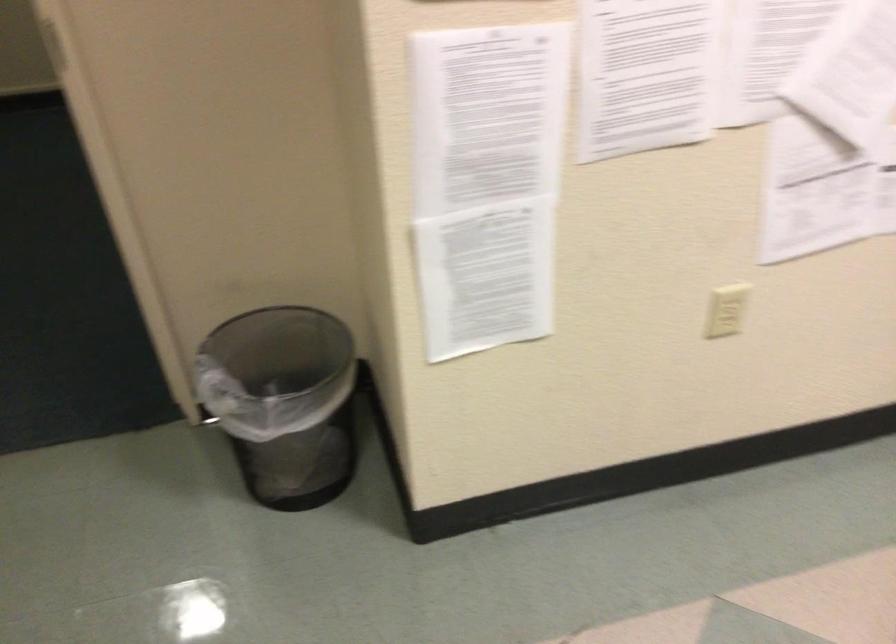
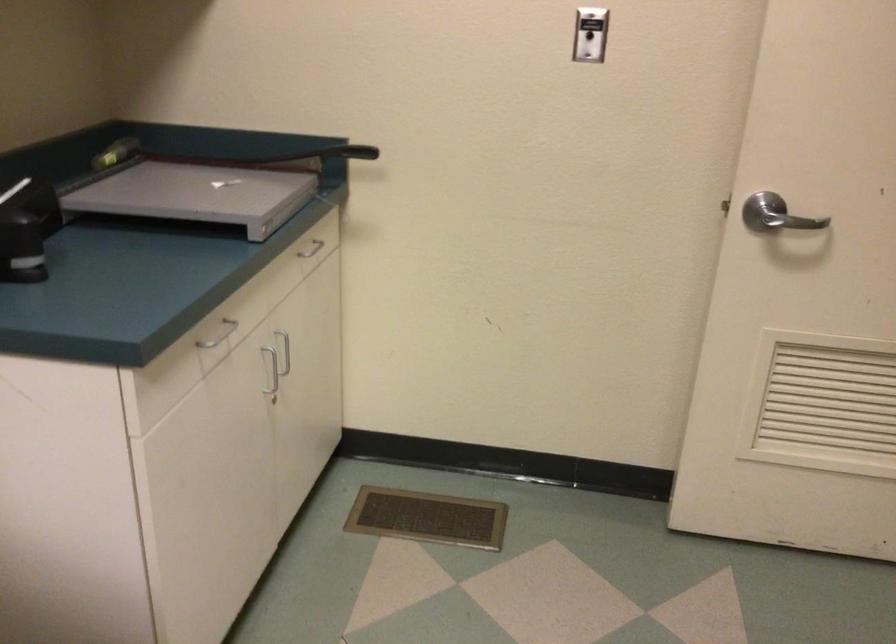
How did the camera likely rotate?

The camera's rotation is toward left-down.